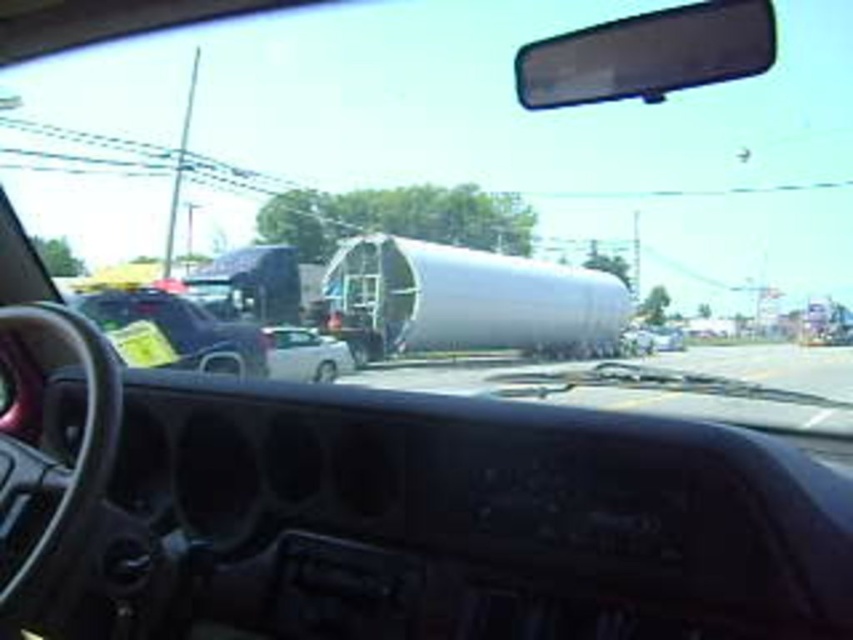
Question: Is matte black car at left behind white glossy car at center?

Choices:
 (A) no
 (B) yes

Answer: (A)

Question: Estimate the real-world distances between objects in this image. Which object is farther from the matte black car at left?

Choices:
 (A) white glossy car at center
 (B) transparent plastic view mirror at upper center

Answer: (B)

Question: Can you confirm if matte black car at left is positioned below white glossy car at center?

Choices:
 (A) yes
 (B) no

Answer: (B)

Question: Does transparent plastic view mirror at upper center appear under white glossy car at center?

Choices:
 (A) no
 (B) yes

Answer: (A)

Question: Which object is positioned farthest from the transparent plastic view mirror at upper center?

Choices:
 (A) white glossy car at center
 (B) matte black car at left

Answer: (A)

Question: Which of the following is the farthest from the observer?

Choices:
 (A) white glossy car at center
 (B) matte black car at left

Answer: (A)